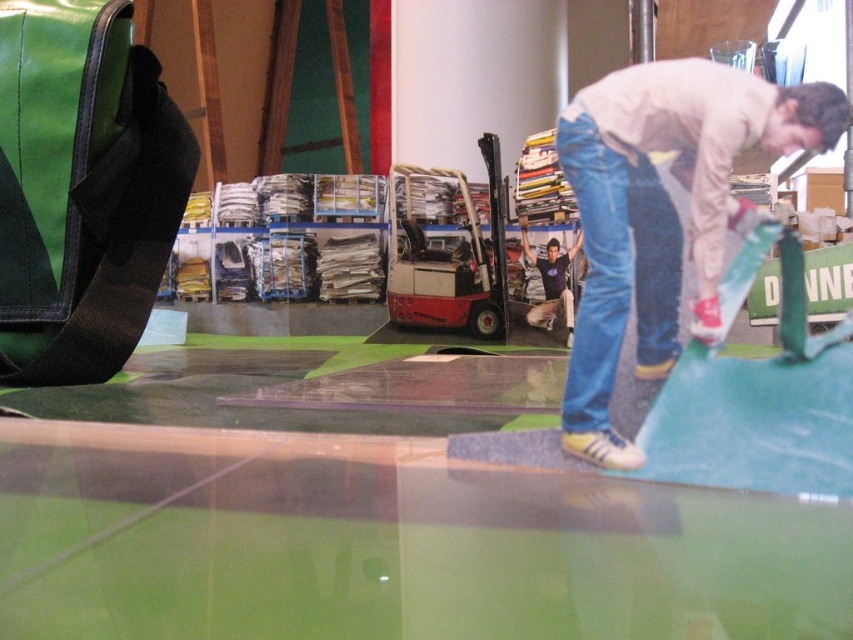
Question: Is the position of green fabric bag at upper left less distant than that of light blue smooth skateboard at right?

Choices:
 (A) no
 (B) yes

Answer: (A)

Question: Can you confirm if light blue smooth skateboard at right is wider than dark blue t-shirt at center?

Choices:
 (A) no
 (B) yes

Answer: (B)

Question: Estimate the real-world distances between objects in this image. Which object is farther from the green fabric bag at upper left?

Choices:
 (A) dark blue t-shirt at center
 (B) light blue smooth skateboard at right

Answer: (A)

Question: Which object is positioned closest to the dark blue t-shirt at center?

Choices:
 (A) green fabric bag at upper left
 (B) light blue smooth skateboard at right

Answer: (A)

Question: Is the position of green fabric bag at upper left less distant than that of dark blue t-shirt at center?

Choices:
 (A) no
 (B) yes

Answer: (B)

Question: Which point is farther from the camera taking this photo?

Choices:
 (A) (827, 141)
 (B) (552, 243)

Answer: (B)